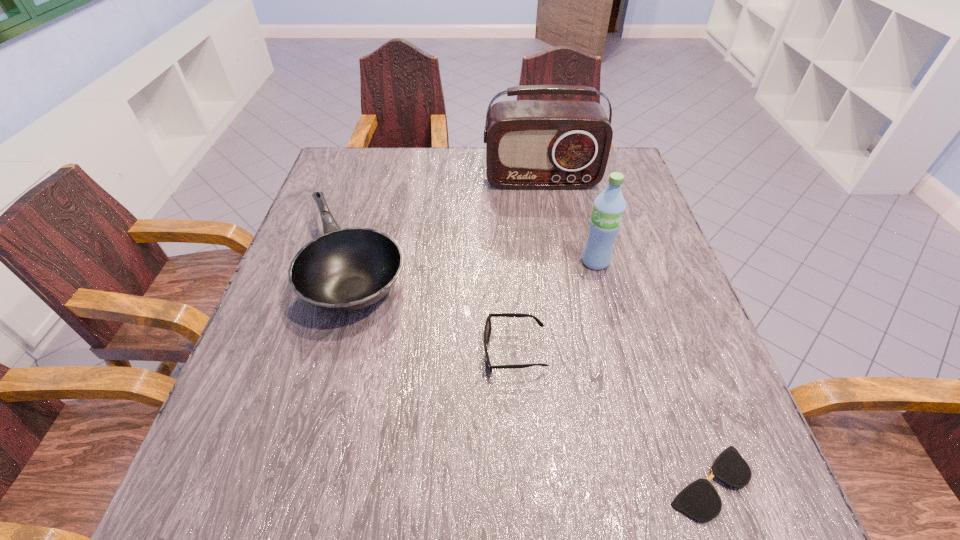
What are the coordinates of `the farthest object` in the screenshot? It's located at pyautogui.click(x=530, y=144).

Identify the location of water bottle. (609, 206).

The image size is (960, 540). What are the coordinates of `the third shortest object` in the screenshot? It's located at (344, 270).

Locate an element on the screen. frying pan is located at coordinates [x=344, y=270].

What are the coordinates of `the fourth tallest object` in the screenshot? It's located at (487, 329).

Where is `the shortest object`? the shortest object is located at coordinates (699, 500).

At what (x,y) coordinates should I click in order to perform the action: click on the nearest object. Please return your answer as a coordinate pair (x, y). This screenshot has height=540, width=960. Looking at the image, I should click on click(699, 500).

In order to click on vacant space located on the front panel of the farthest object in this screenshot , I will do `click(556, 262)`.

Where is `free region located 0.150m on the back of the water bottle`? free region located 0.150m on the back of the water bottle is located at coordinates (583, 214).

Where is `vacant space situated 0.310m on the front of the frying pan`? The height and width of the screenshot is (540, 960). vacant space situated 0.310m on the front of the frying pan is located at coordinates (294, 494).